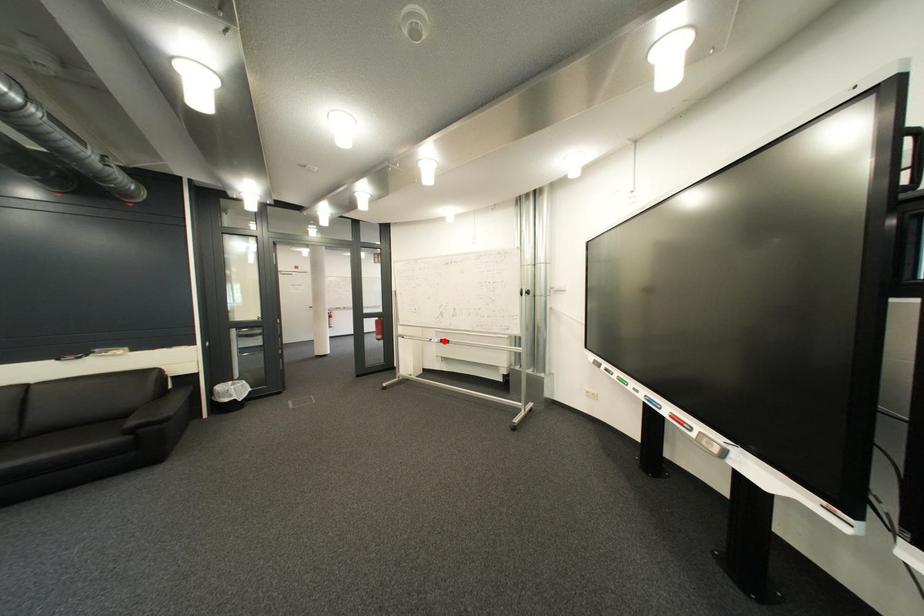
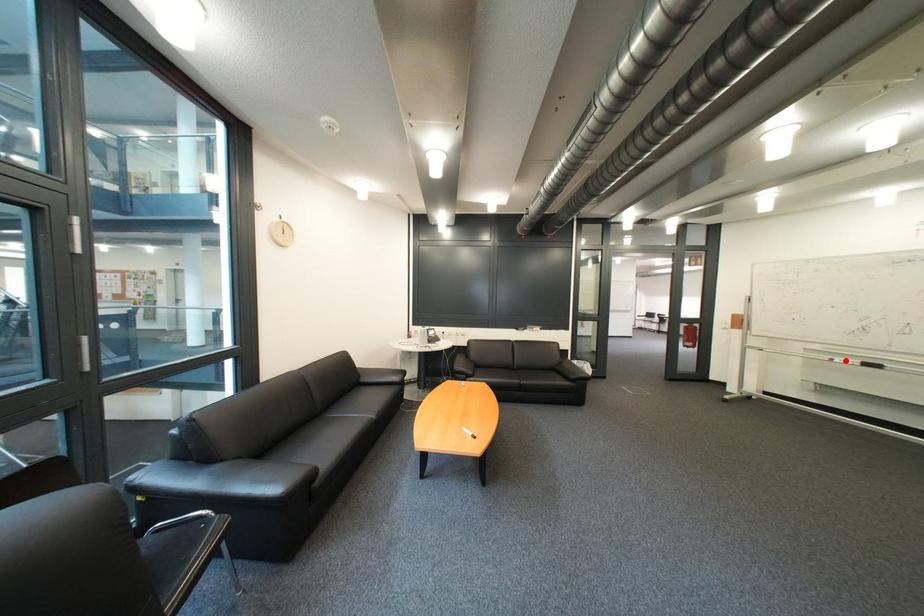
I am providing you with two images of the same scene from different viewpoints. A red point is marked on the first image and another point is marked on the second image. Are the points marked in image1 and image2 representing the same 3D position?

Yes